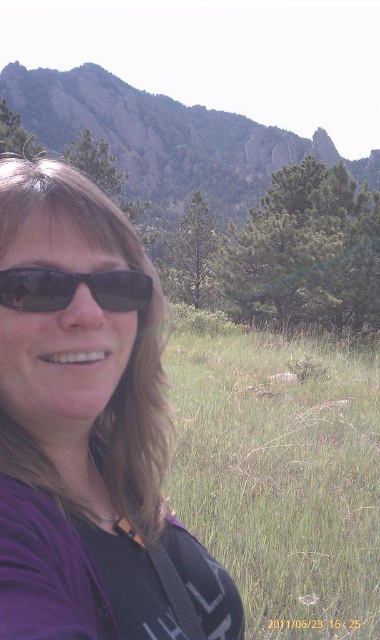
You are standing in the scene and want to place a small flag at both point (171, 403) and point (6, 280). Which point is closer to your current position?

Point (6, 280) is closer to your current position because it is closer to the viewer than point (171, 403), which is further away.

You are a photographer trying to capture the scenic mountain backdrop. You notice the green grass at center and the matte black sunglasses at left in your frame. Which object is taller in the image?

The green grass at center is taller than the matte black sunglasses at left.